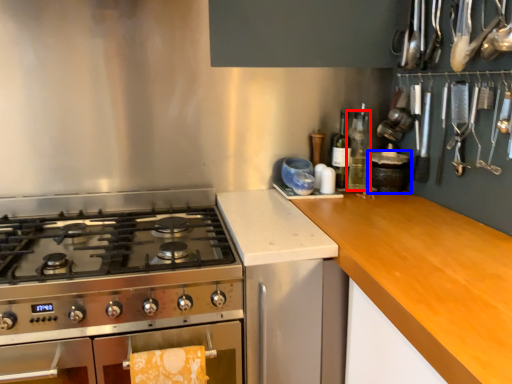
Question: Which point is further to the camera, bottle (highlighted by a red box) or kitchen appliance (highlighted by a blue box)?

Choices:
 (A) bottle
 (B) kitchen appliance

Answer: (A)